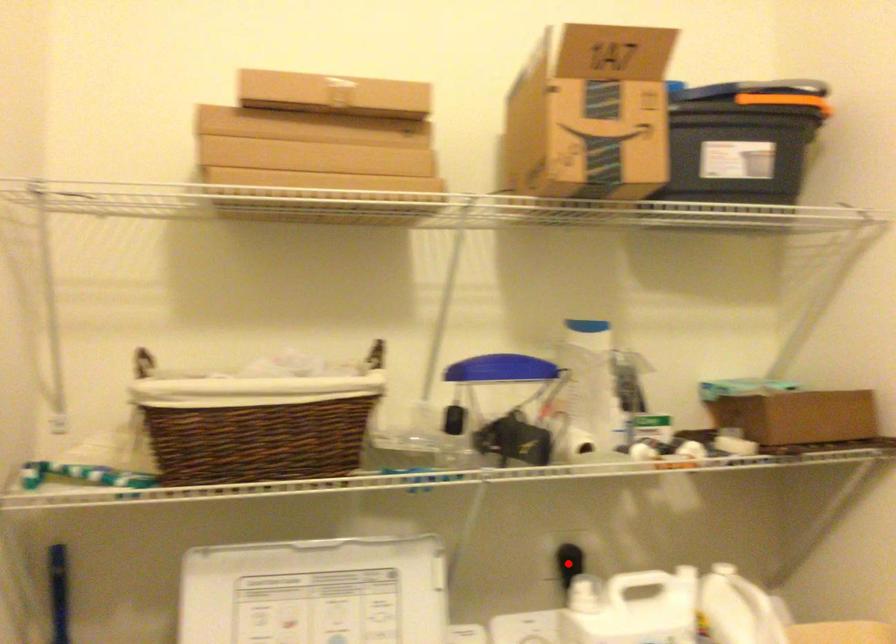
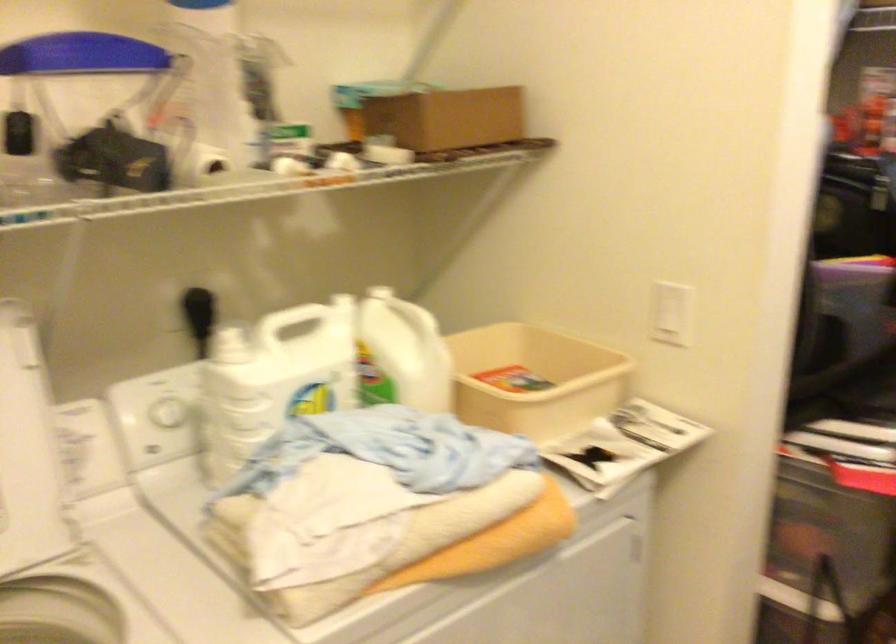
Question: I am providing you with two images of the same scene from different viewpoints. Given a red point in image1, look at the same physical point in image2. Is it:

Choices:
 (A) Closer to the viewpoint
 (B) Farther from the viewpoint

Answer: (A)